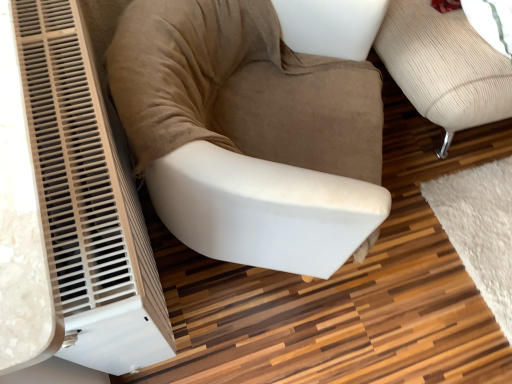
Question: Can you confirm if beige corduroy armchair at center is taller than suede-like beige armchair at center-left?

Choices:
 (A) no
 (B) yes

Answer: (B)

Question: Is beige corduroy armchair at center to the left of suede-like beige armchair at center-left from the viewer's perspective?

Choices:
 (A) no
 (B) yes

Answer: (A)

Question: Is beige corduroy armchair at center wider than suede-like beige armchair at center-left?

Choices:
 (A) yes
 (B) no

Answer: (A)

Question: Is suede-like beige armchair at center-left at the back of beige corduroy armchair at center?

Choices:
 (A) yes
 (B) no

Answer: (B)

Question: Is beige corduroy armchair at center smaller than suede-like beige armchair at center-left?

Choices:
 (A) yes
 (B) no

Answer: (B)

Question: Is beige corduroy armchair at center not inside suede-like beige armchair at center-left?

Choices:
 (A) no
 (B) yes

Answer: (B)

Question: Is suede-like beige armchair at center-left directly adjacent to beige corduroy armchair at center?

Choices:
 (A) yes
 (B) no

Answer: (B)

Question: From the image's perspective, is suede-like beige armchair at center-left below beige corduroy armchair at center?

Choices:
 (A) yes
 (B) no

Answer: (A)

Question: Is beige corduroy armchair at center located within suede-like beige armchair at center-left?

Choices:
 (A) no
 (B) yes

Answer: (A)

Question: From a real-world perspective, is suede-like beige armchair at center-left positioned under beige corduroy armchair at center based on gravity?

Choices:
 (A) yes
 (B) no

Answer: (A)

Question: From the image's perspective, is suede-like beige armchair at center-left located above beige corduroy armchair at center?

Choices:
 (A) yes
 (B) no

Answer: (B)

Question: Considering the relative sizes of suede-like beige armchair at center-left and beige corduroy armchair at center in the image provided, is suede-like beige armchair at center-left taller than beige corduroy armchair at center?

Choices:
 (A) yes
 (B) no

Answer: (B)

Question: Is suede-like beige armchair at center-left situated inside beige corduroy armchair at center or outside?

Choices:
 (A) outside
 (B) inside

Answer: (A)